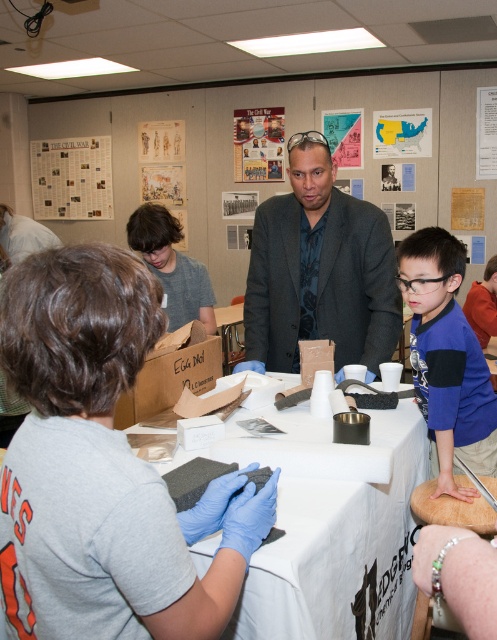
Question: Among these points, which one is nearest to the camera?

Choices:
 (A) (135, 483)
 (B) (447, 324)
 (C) (184, 321)
 (D) (66, 161)

Answer: (A)

Question: Does white paper towel at center have a larger size compared to matte paper bulletin board at upper left?

Choices:
 (A) yes
 (B) no

Answer: (A)

Question: Which point appears closest to the camera in this image?

Choices:
 (A) (422, 493)
 (B) (304, 577)
 (C) (481, 179)

Answer: (B)

Question: In this image, where is matte paper bulletin board at upper left located relative to wooden cutting board at center?

Choices:
 (A) above
 (B) below

Answer: (A)

Question: Which point is closer to the camera?

Choices:
 (A) (180, 253)
 (B) (248, 342)
 (C) (50, 216)
 (D) (489, 141)

Answer: (B)

Question: Observing the image, what is the correct spatial positioning of dark gray suit at center in reference to white paper poster at upper center?

Choices:
 (A) right
 (B) left

Answer: (B)